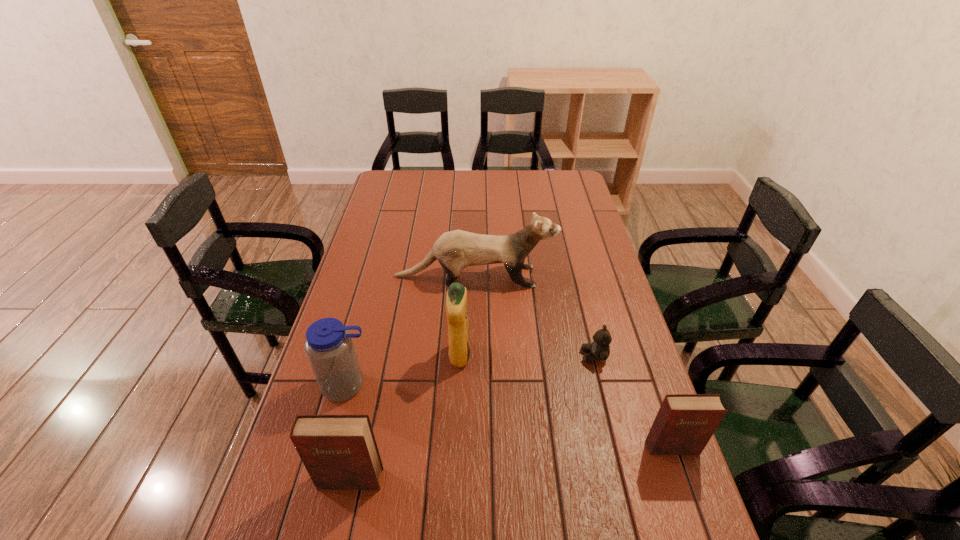
The image size is (960, 540). I want to click on the nearest object, so click(x=339, y=452).

At what (x,y) coordinates should I click in order to perform the action: click on the left diary. Please return your answer as a coordinate pair (x, y). The width and height of the screenshot is (960, 540). Looking at the image, I should click on (339, 452).

The width and height of the screenshot is (960, 540). What are the coordinates of `the right diary` in the screenshot? It's located at (684, 424).

Locate an element on the screen. the farther diary is located at coordinates (684, 424).

Image resolution: width=960 pixels, height=540 pixels. I want to click on water bottle, so click(x=329, y=346).

You are a GUI agent. You are given a task and a screenshot of the screen. Output one action in this format:
    pyautogui.click(x=<x>, y=<y>)
    Task: Click on the farthest object
    This screenshot has width=960, height=540.
    Given the screenshot: What is the action you would take?
    pyautogui.click(x=455, y=250)

Find the location of `detergent`. detergent is located at coordinates (456, 299).

Where is `the shortest object`? Image resolution: width=960 pixels, height=540 pixels. the shortest object is located at coordinates (600, 349).

This screenshot has width=960, height=540. Find the location of `teddy bear`. teddy bear is located at coordinates (600, 349).

Where is `blank space located 0.070m on the front cover of the left diary`? blank space located 0.070m on the front cover of the left diary is located at coordinates (340, 524).